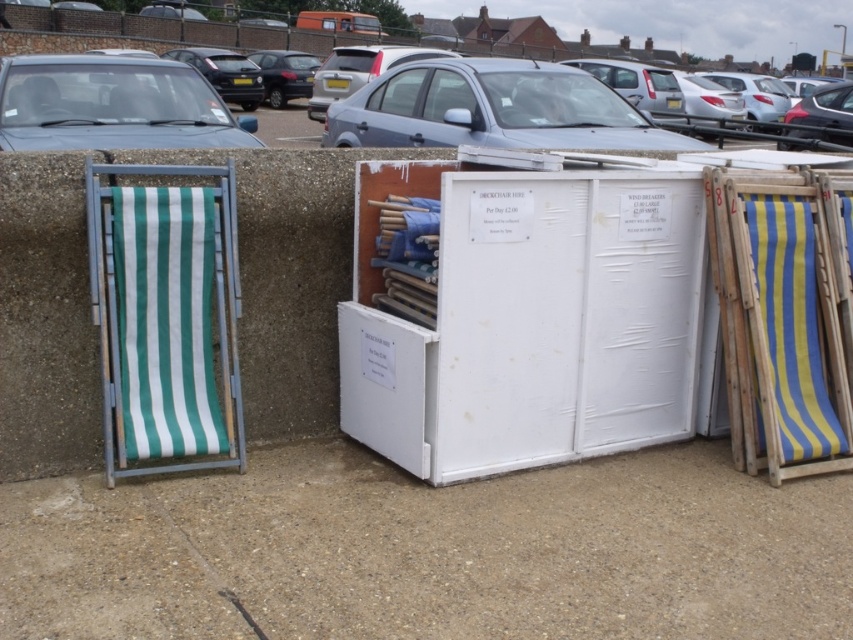
You are standing in front of the beach chairs and the storage unit. You need to place a new beach chair exactly at the midpoint between the blue striped wood at right and the stack of folded beach chairs inside the white plastic storage unit. Where should you place the new chair?

The midpoint between the blue striped wood at right and the stack of folded beach chairs inside the white plastic storage unit would be at the average of their coordinates. Since the blue striped wood at right is at point (782, 317), and the stack of folded beach chairs are inside the storage unit, their coordinates are not provided. Without the exact coordinates of the stack, it is impossible to determine the midpoint. Please provide the coordinates of the stack to calculate the midpoint.